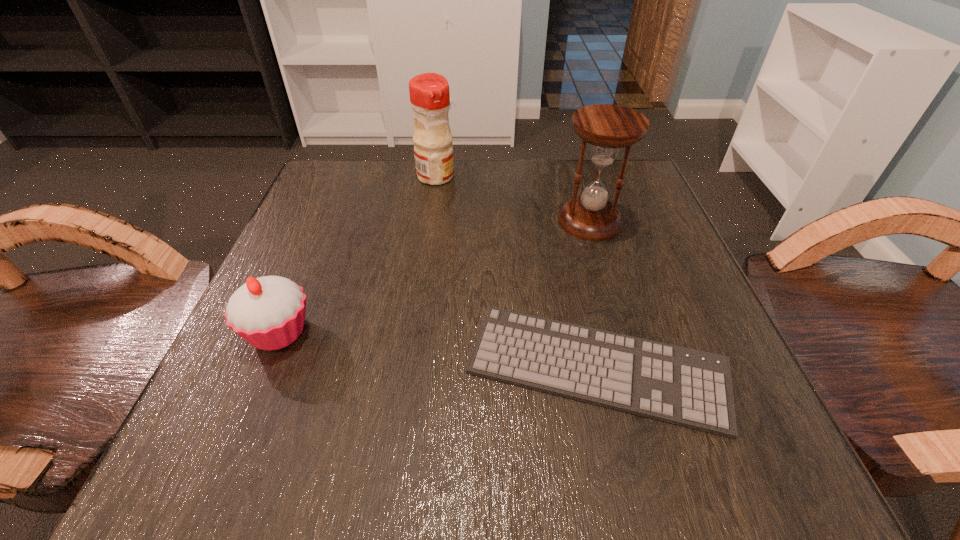
Identify the location of empty space between the third object from right to left and the computer keyboard. This screenshot has width=960, height=540. (516, 272).

Where is `vacant space that's between the computer keyboard and the second farthest object`? vacant space that's between the computer keyboard and the second farthest object is located at coordinates (593, 295).

Locate an element on the screen. This screenshot has width=960, height=540. free space between the third object from right to left and the cupcake is located at coordinates (357, 254).

This screenshot has height=540, width=960. I want to click on object that stands as the second closest to the farthest object, so click(268, 312).

You are a GUI agent. You are given a task and a screenshot of the screen. Output one action in this format:
    pyautogui.click(x=<x>, y=<y>)
    Task: Click on the object that is the third closest to the third object from right to left
    Image resolution: width=960 pixels, height=540 pixels.
    Given the screenshot: What is the action you would take?
    pyautogui.click(x=692, y=388)

The width and height of the screenshot is (960, 540). Find the location of `free spot that satisfies the following two spatial constraints: 1. on the front side of the condiment; 2. on the left side of the shortest object`. free spot that satisfies the following two spatial constraints: 1. on the front side of the condiment; 2. on the left side of the shortest object is located at coordinates (x=409, y=368).